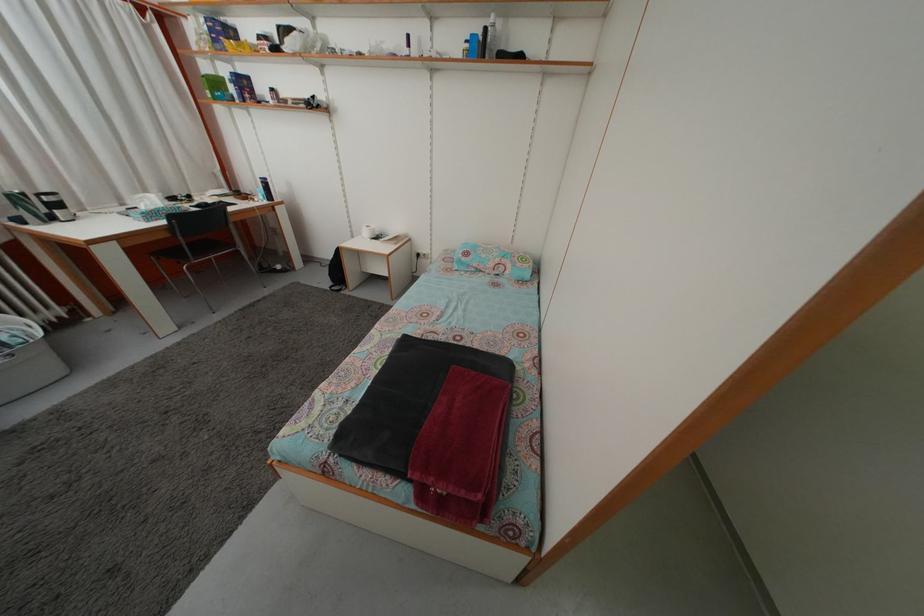
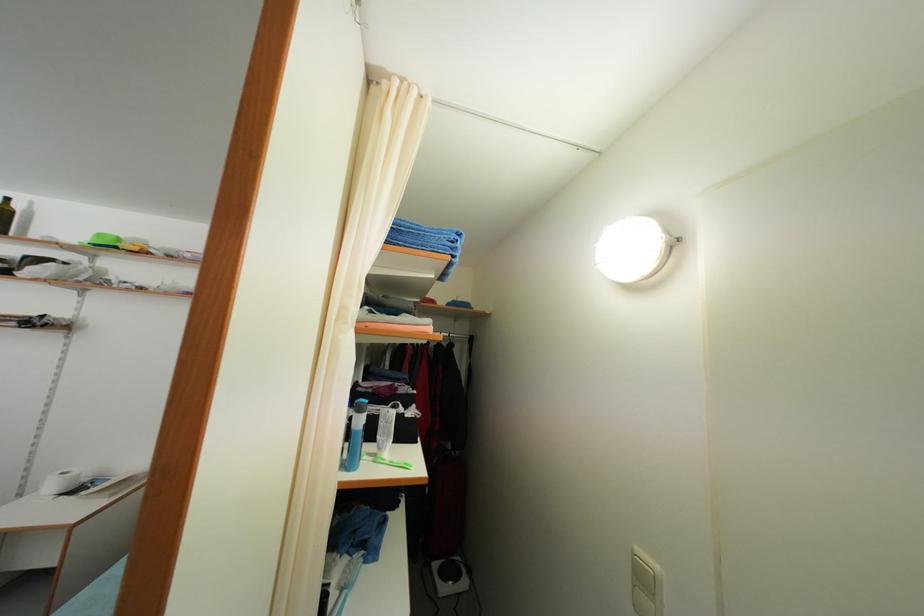
First-person continuous shooting, in which direction is the camera rotating?

The rotation direction of the camera is right-up.